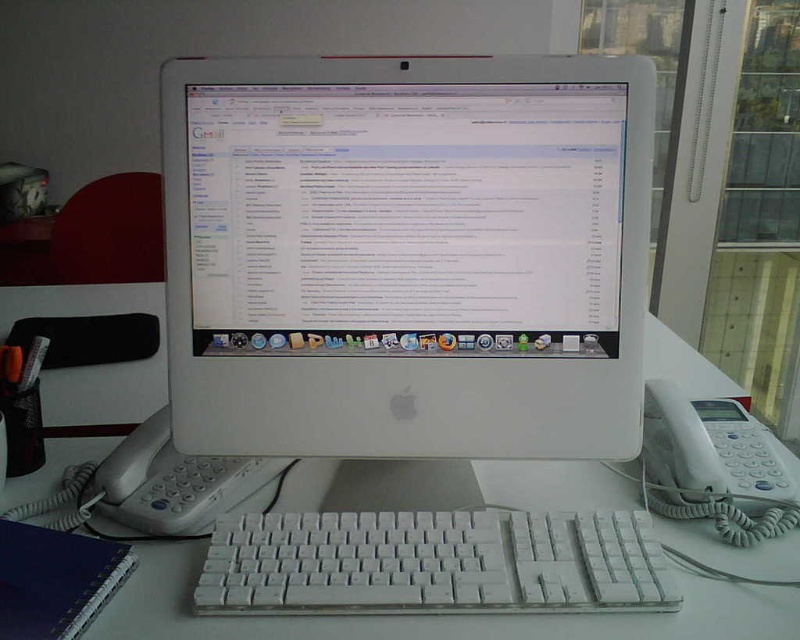
Who is more distant from viewer, (124,412) or (240,593)?

The point (124,412) is more distant.

Who is shorter, white plastic computer desk at center or white plastic keyboard at center?

Standing shorter between the two is white plastic keyboard at center.

Is point (444, 460) positioned behind point (248, 573)?

That is True.

Locate an element on the screen. white plastic computer desk at center is located at coordinates (433, 616).

Does white glossy monitor at center appear over white plastic keyboard at center?

Indeed, white glossy monitor at center is positioned over white plastic keyboard at center.

Is white glossy monitor at center below white plastic keyboard at center?

Actually, white glossy monitor at center is above white plastic keyboard at center.

Where is `white glossy monitor at center`? The image size is (800, 640). white glossy monitor at center is located at coordinates (406, 253).

Between white glossy monitor at center and white plastic computer desk at center, which one appears on the left side from the viewer's perspective?

white plastic computer desk at center

Does white glossy monitor at center have a greater width compared to white plastic computer desk at center?

Incorrect, white glossy monitor at center's width does not surpass white plastic computer desk at center's.

Between point (462, 177) and point (424, 492), which one is positioned behind?

The point (424, 492) is behind.

In order to click on white glossy monitor at center in this screenshot , I will do `click(406, 253)`.